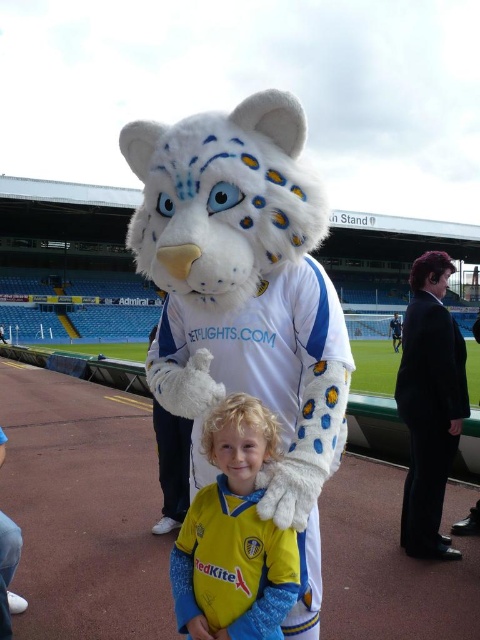
You are a photographer positioned at the center of the field. You want to take a photo that includes both the yellow jersey at center and the black suit at right. What is the minimum distance you need to move backward to ensure both subjects are in frame?

The minimum distance you need to move backward is 6.76 feet to ensure both the yellow jersey at center and the black suit at right are in frame.

You are a photographer trying to capture a photo of the yellow jersey at center and the black suit at right. Based on their heights, which one should you adjust your camera angle to look up at?

The yellow jersey at center is shorter than the black suit at right, so you should adjust your camera angle to look up at the black suit at right.

You are a photographer positioned at the front of the stadium. You need to capture a photo that includes both the yellow jersey at center and the black suit at right. Based on their positions, which object should you adjust your camera angle to focus on first to ensure both are in frame?

The yellow jersey at center is to the left of the black suit at right. To include both in the frame, focus on the yellow jersey at center first as it is positioned on the left side, then adjust to include the black suit at right on the right side.